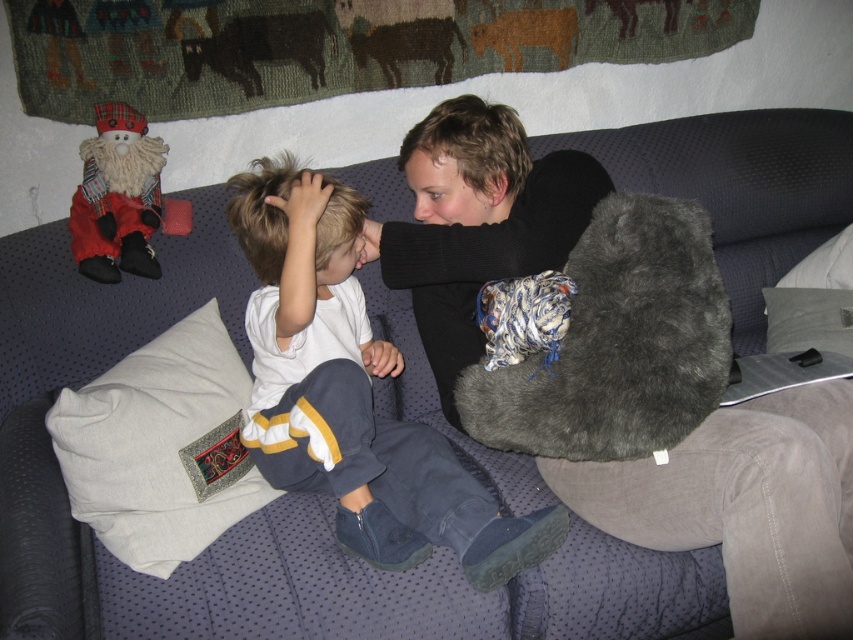
Consider the image. Between white cotton shirt at center and white cotton pillow at lower left, which one has more height?

With more height is white cotton shirt at center.

Who is more distant from viewer, (x=363, y=387) or (x=167, y=433)?

Point (x=167, y=433)

What do you see at coordinates (352, 394) in the screenshot?
I see `white cotton shirt at center` at bounding box center [352, 394].

At what (x,y) coordinates should I click in order to perform the action: click on white cotton shirt at center. Please return your answer as a coordinate pair (x, y). Looking at the image, I should click on (352, 394).

Is fuzzy gray pillow at center below fuzzy red santa at upper left?

Yes.

Based on the photo, between fuzzy gray pillow at center and fuzzy red santa at upper left, which one is positioned lower?

fuzzy gray pillow at center is lower down.

The image size is (853, 640). Find the location of `fuzzy gray pillow at center`. fuzzy gray pillow at center is located at coordinates coord(618,342).

You are a GUI agent. You are given a task and a screenshot of the screen. Output one action in this format:
    pyautogui.click(x=<x>, y=<y>)
    Task: Click on the fuzzy gray pillow at center
    Image resolution: width=853 pixels, height=640 pixels.
    Given the screenshot: What is the action you would take?
    pyautogui.click(x=618, y=342)

Is white cotton pillow at lower left further to camera compared to brown wool cow at upper center?

No, white cotton pillow at lower left is closer to the viewer.

Between white cotton pillow at lower left and brown wool cow at upper center, which one appears on the right side from the viewer's perspective?

brown wool cow at upper center is more to the right.

In order to click on white cotton pillow at lower left in this screenshot , I will do `click(161, 445)`.